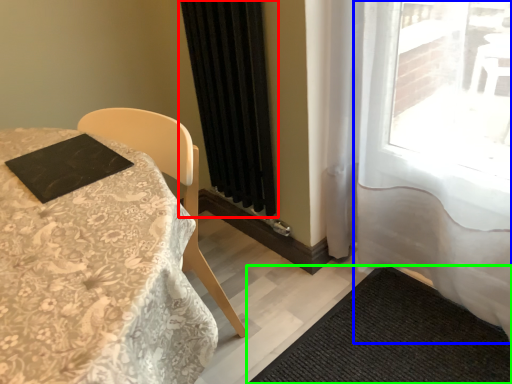
Question: Considering the real-world distances, which object is closest to curtain (highlighted by a red box)? curtain (highlighted by a blue box) or doormat (highlighted by a green box).

Choices:
 (A) curtain
 (B) doormat

Answer: (A)